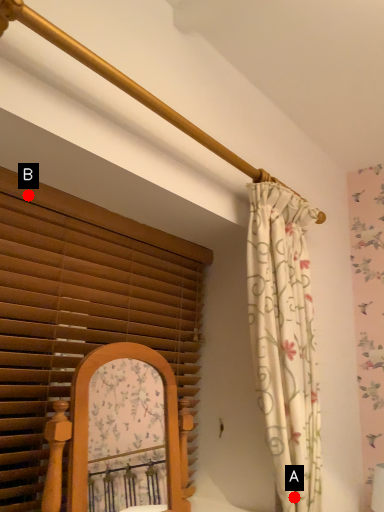
Question: Two points are circled on the image, labeled by A and B beside each circle. Which of the following is the closest to the observer?

Choices:
 (A) A is closer
 (B) B is closer

Answer: (B)